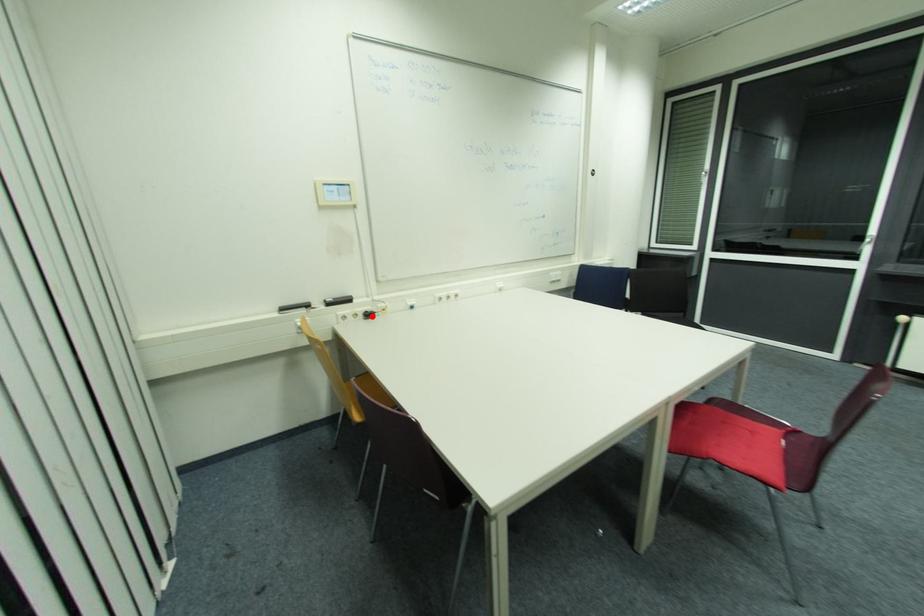
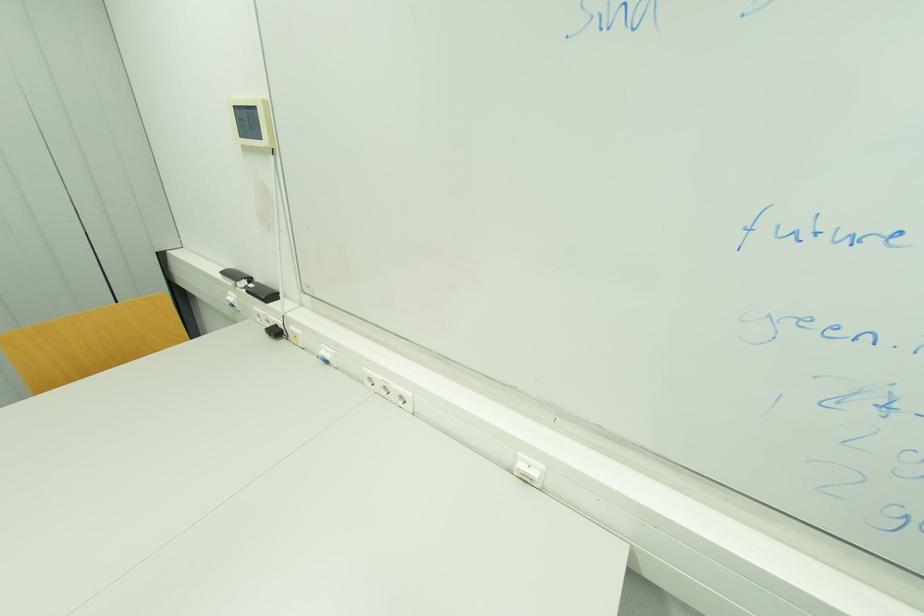
In the second image, find the point that corresponds to the highlighted location in the first image.

(281, 333)